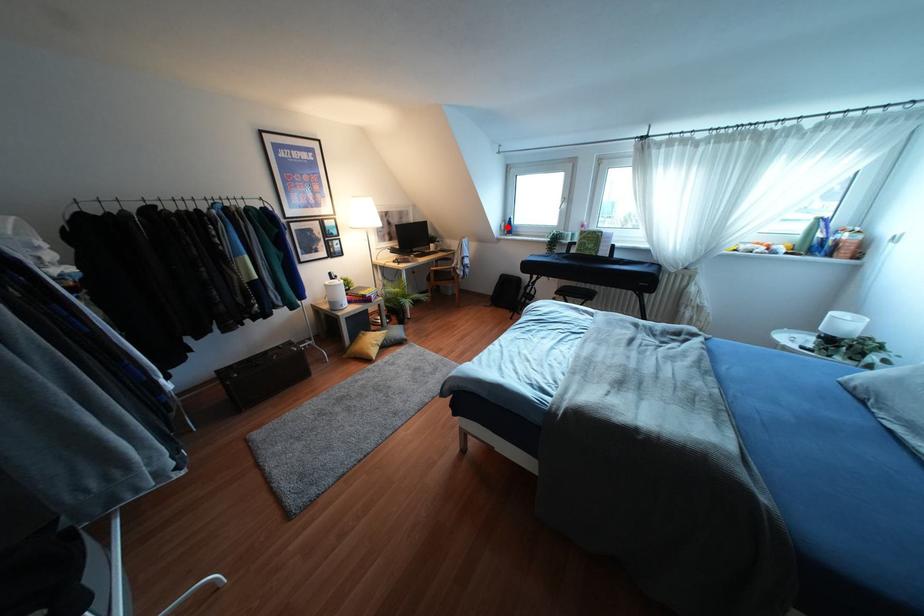
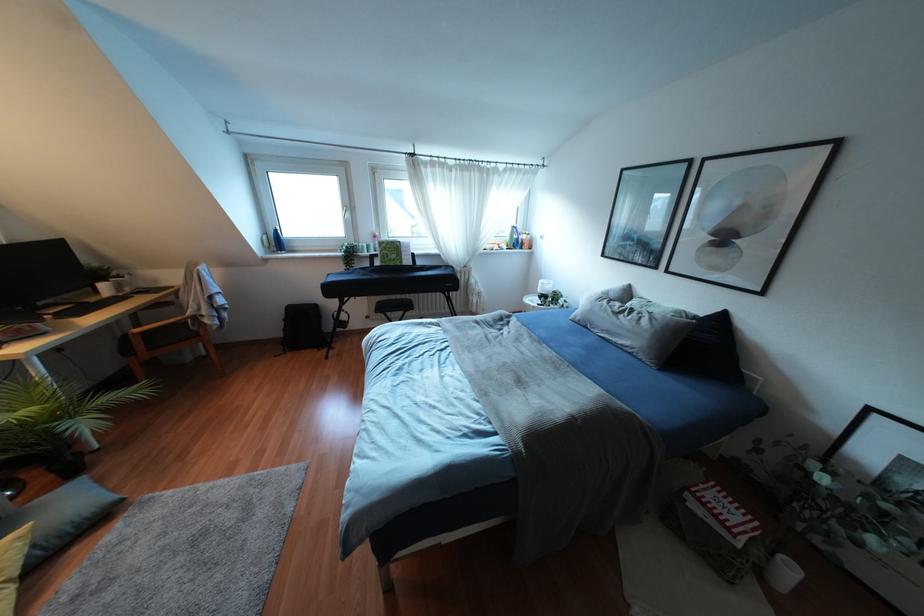
Question: I am providing you with two images of the same scene from different viewpoints. In image1, a red point is highlighted. Considering the same 3D point in image2, which of the following is correct?

Choices:
 (A) It is closer
 (B) It is farther

Answer: (B)